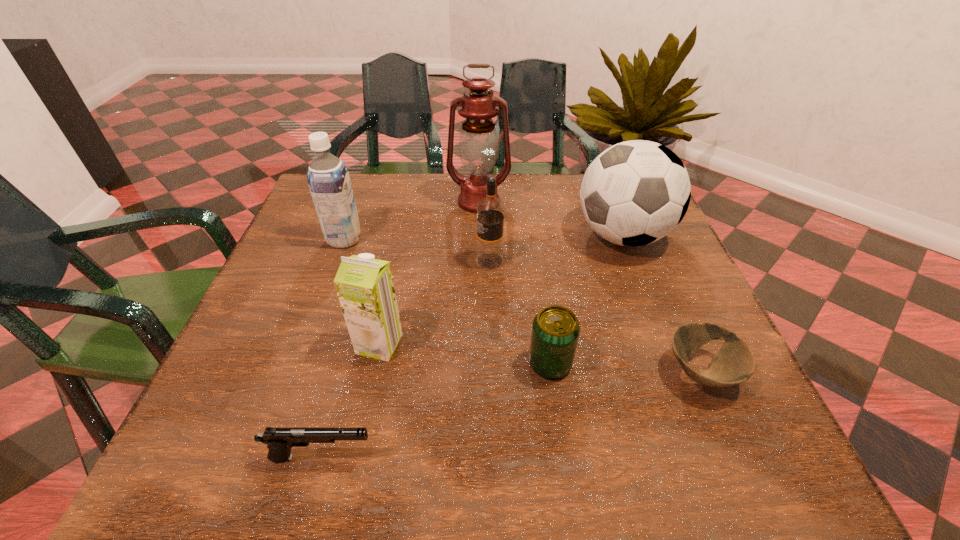
Locate an element on the screen. the second shortest object is located at coordinates (279, 440).

In order to click on the shortest object in this screenshot , I will do pyautogui.click(x=734, y=363).

At what (x,y) coordinates should I click in order to perform the action: click on vacant position located 0.380m on the front of the oil lamp. Please return your answer as a coordinate pair (x, y). This screenshot has height=540, width=960. Looking at the image, I should click on (478, 323).

Locate an element on the screen. free spot located 0.100m on the label of the taller soya milk is located at coordinates (401, 239).

In order to click on vacant space located 0.210m on the main logo of the soccer ball in this screenshot , I will do `click(489, 235)`.

Identify the location of free spot located 0.200m on the main logo of the soccer ball. Image resolution: width=960 pixels, height=540 pixels. (492, 235).

You are a GUI agent. You are given a task and a screenshot of the screen. Output one action in this format:
    pyautogui.click(x=<x>, y=<y>)
    Task: Click on the free space located 0.100m on the main logo of the soccer ball
    The height and width of the screenshot is (540, 960).
    Given the screenshot: What is the action you would take?
    pyautogui.click(x=533, y=235)

The image size is (960, 540). I want to click on vacant area situated 0.390m on the label of the vodka, so click(306, 261).

The width and height of the screenshot is (960, 540). In order to click on free region located 0.380m on the label of the vodka in this screenshot , I will do pos(310,261).

Find the location of a particular element. The width and height of the screenshot is (960, 540). free spot located 0.340m on the label of the vodka is located at coordinates (328, 261).